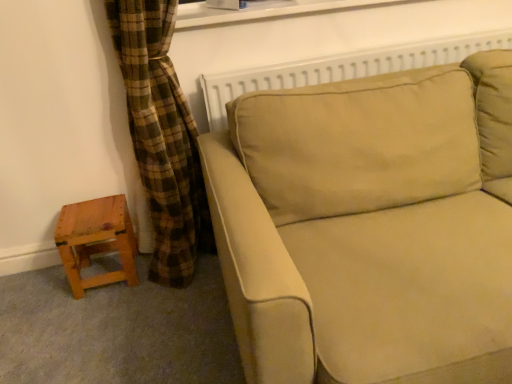
Question: Is white plastic window frame at upper center facing towards beige fabric couch at center?

Choices:
 (A) no
 (B) yes

Answer: (A)

Question: Is white plastic window frame at upper center facing away from beige fabric couch at center?

Choices:
 (A) yes
 (B) no

Answer: (B)

Question: Could beige fabric couch at center be considered to be inside white plastic window frame at upper center?

Choices:
 (A) yes
 (B) no

Answer: (B)

Question: From a real-world perspective, is white plastic window frame at upper center positioned over beige fabric couch at center based on gravity?

Choices:
 (A) no
 (B) yes

Answer: (B)

Question: Is white plastic window frame at upper center touching beige fabric couch at center?

Choices:
 (A) no
 (B) yes

Answer: (A)

Question: Considering the positions of point (74, 249) and point (212, 21), is point (74, 249) closer or farther from the camera than point (212, 21)?

Choices:
 (A) farther
 (B) closer

Answer: (A)

Question: Do you think wooden stool at lower left is within white plastic window frame at upper center, or outside of it?

Choices:
 (A) inside
 (B) outside

Answer: (B)

Question: Based on their sizes in the image, would you say wooden stool at lower left is bigger or smaller than white plastic window frame at upper center?

Choices:
 (A) big
 (B) small

Answer: (B)

Question: In terms of width, does wooden stool at lower left look wider or thinner when compared to white plastic window frame at upper center?

Choices:
 (A) wide
 (B) thin

Answer: (B)

Question: Do you think beige fabric couch at center is within wooden stool at lower left, or outside of it?

Choices:
 (A) inside
 (B) outside

Answer: (B)

Question: Considering the positions of beige fabric couch at center and wooden stool at lower left in the image, is beige fabric couch at center wider or thinner than wooden stool at lower left?

Choices:
 (A) thin
 (B) wide

Answer: (B)

Question: From the image's perspective, is beige fabric couch at center above or below wooden stool at lower left?

Choices:
 (A) below
 (B) above

Answer: (B)

Question: From a real-world perspective, is beige fabric couch at center physically located above or below wooden stool at lower left?

Choices:
 (A) above
 (B) below

Answer: (A)

Question: Is white plastic window frame at upper center taller or shorter than wooden stool at lower left?

Choices:
 (A) short
 (B) tall

Answer: (A)

Question: Considering their positions, is white plastic window frame at upper center located in front of or behind wooden stool at lower left?

Choices:
 (A) front
 (B) behind

Answer: (A)